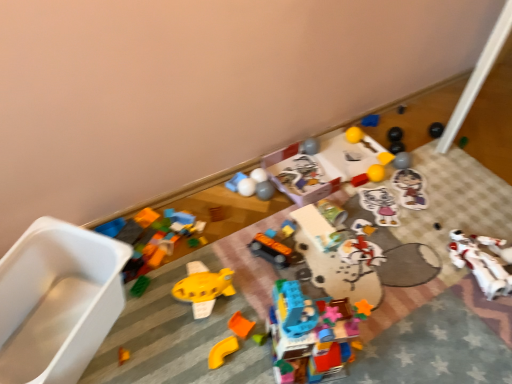
Identify the location of empty space that is in between matte black car at center, the tenth toy positioned from the right, and orange matte block at center, which ranks as the fifth toy in left-to-right order. (255, 289).